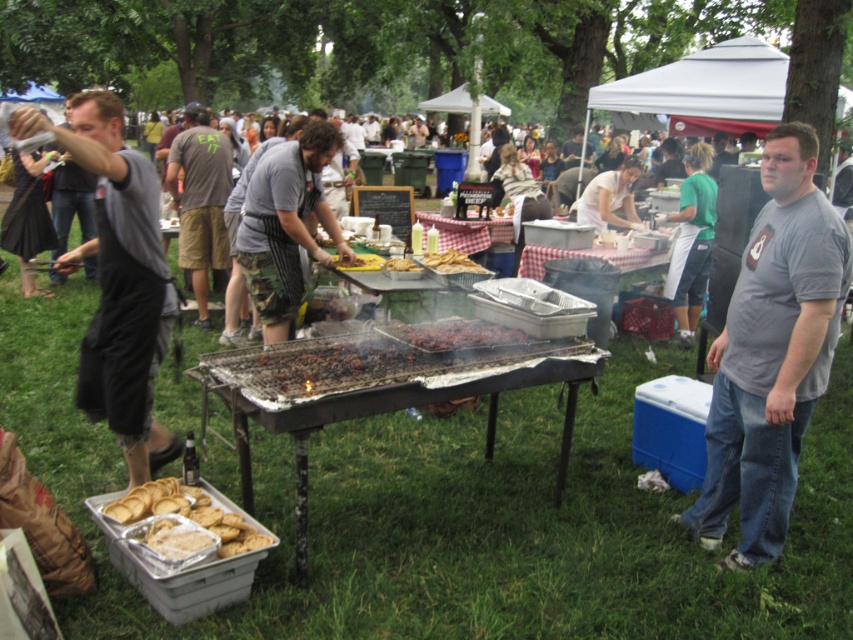
Which is below, gray cotton t-shirt at right or gray fabric shirt at left?

gray cotton t-shirt at right is lower down.

Between gray cotton t-shirt at right and gray fabric shirt at left, which one has more height?

gray cotton t-shirt at right is taller.

Is point (763, 516) closer to viewer compared to point (16, 125)?

No.

The width and height of the screenshot is (853, 640). I want to click on gray cotton t-shirt at right, so click(x=770, y=353).

Is dark gray t-shirt at center smaller than brown matte bread at center?

Actually, dark gray t-shirt at center might be larger than brown matte bread at center.

Does point (175, 198) lie in front of point (375, 268)?

No.

Find the location of a particular element. This screenshot has width=853, height=640. dark gray t-shirt at center is located at coordinates (200, 202).

Is the position of golden brown crispy bread at lower left less distant than that of charcoal grill at center?

Yes, it is in front of charcoal grill at center.

Can you confirm if golden brown crispy bread at lower left is wider than charcoal grill at center?

Indeed, golden brown crispy bread at lower left has a greater width compared to charcoal grill at center.

Locate an element on the screen. The width and height of the screenshot is (853, 640). golden brown crispy bread at lower left is located at coordinates (213, 520).